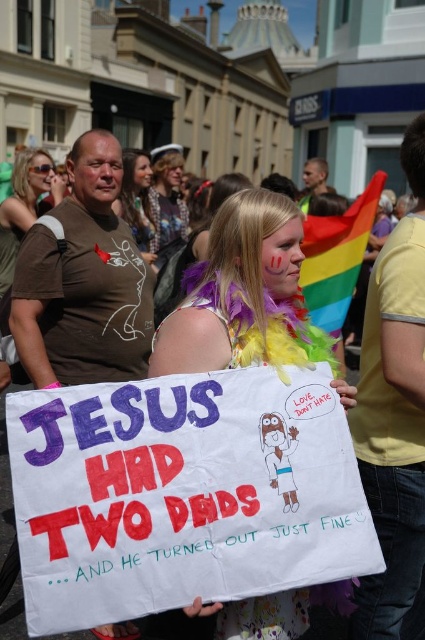
This screenshot has width=425, height=640. What do you see at coordinates (243, 294) in the screenshot?
I see `rainbow feather boa at center` at bounding box center [243, 294].

Who is higher up, rainbow feather boa at center or blonde hair at center?

blonde hair at center is higher up.

Is point (227, 268) more distant than point (121, 212)?

No, it is in front of (121, 212).

The width and height of the screenshot is (425, 640). In order to click on rainbow feather boa at center in this screenshot , I will do `click(243, 294)`.